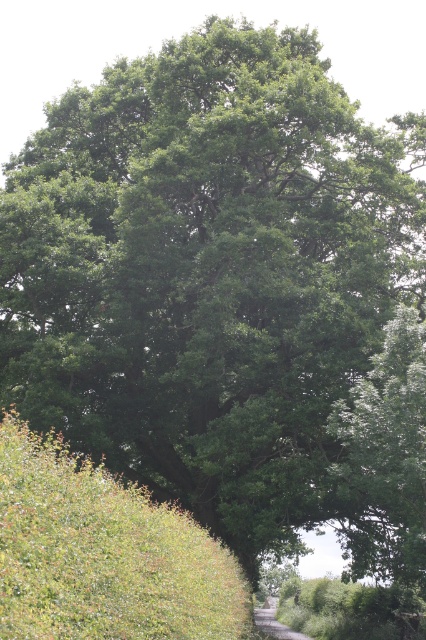
Image resolution: width=426 pixels, height=640 pixels. Describe the element at coordinates (103, 554) in the screenshot. I see `green leafy hedge at lower left` at that location.

The height and width of the screenshot is (640, 426). What are the coordinates of `green leafy hedge at lower left` in the screenshot? It's located at (103, 554).